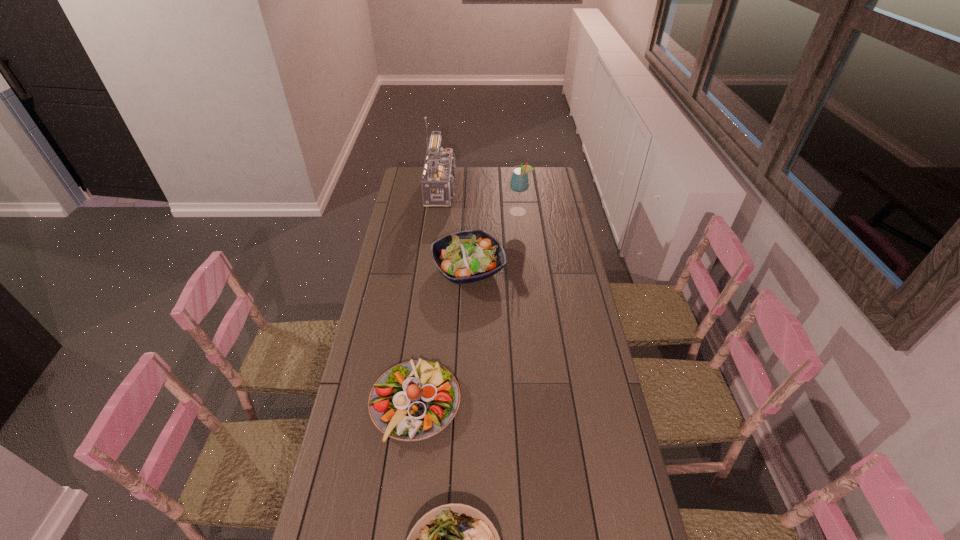
In order to click on blank space located on the right of the second shortest object in this screenshot , I will do `click(549, 403)`.

You are a GUI agent. You are given a task and a screenshot of the screen. Output one action in this format:
    pyautogui.click(x=<x>, y=<y>)
    Task: Click on the object that is at the far edge
    Image resolution: width=960 pixels, height=540 pixels.
    Given the screenshot: What is the action you would take?
    pyautogui.click(x=438, y=177)

Find the location of a particular element. radio receiver positioned at the left edge is located at coordinates (438, 177).

What are the coordinates of `salad plate present at the left edge` in the screenshot? It's located at (415, 400).

The height and width of the screenshot is (540, 960). I want to click on object present at the far left corner, so click(x=438, y=177).

Image resolution: width=960 pixels, height=540 pixels. I want to click on vacant space at the left edge, so click(399, 324).

In the image, there is a desktop. Identify the location of vacant area at the right edge. (553, 320).

Where is `free space at the far left corner of the desktop`? Image resolution: width=960 pixels, height=540 pixels. free space at the far left corner of the desktop is located at coordinates (409, 168).

Locate an element on the screen. free region at the far right corner is located at coordinates (556, 173).

Locate an element on the screen. This screenshot has width=960, height=540. free space between the second farthest salad plate and the farthest salad plate is located at coordinates (442, 336).